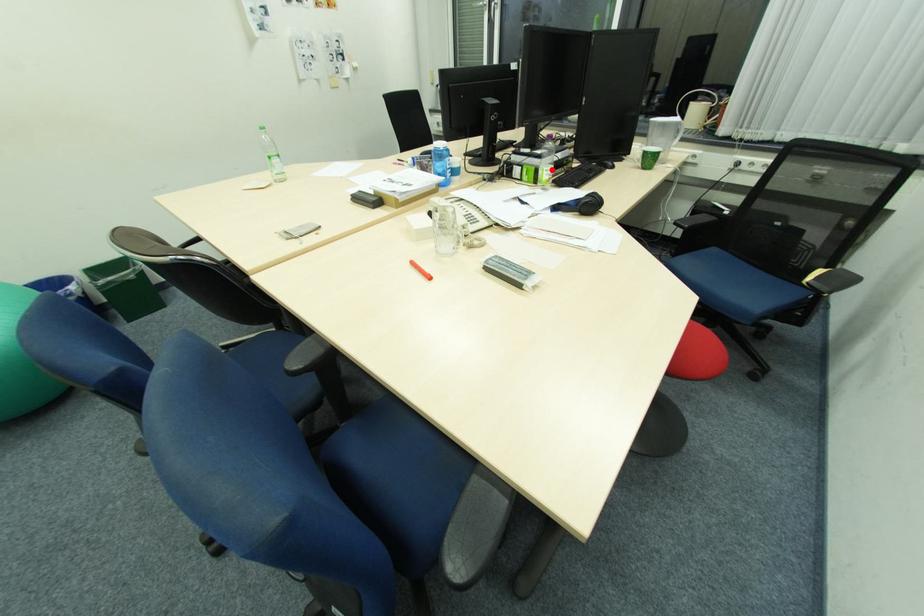
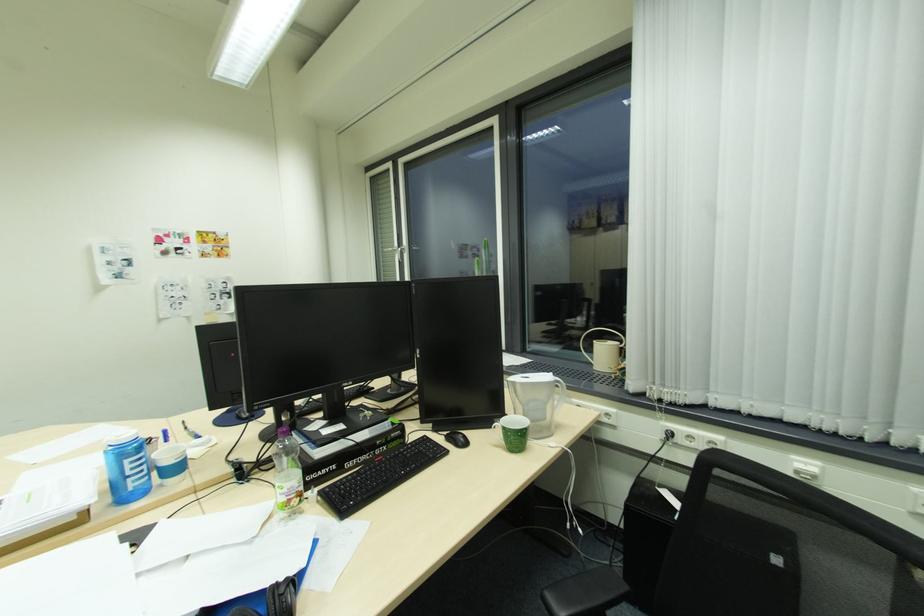
Where in the second image is the point corresponding to the highlighted location from the first image?

(286, 485)